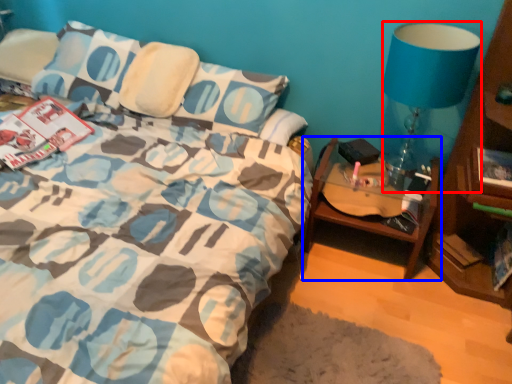
Question: Among these objects, which one is nearest to the camera, lamp (highlighted by a red box) or table (highlighted by a blue box)?

Choices:
 (A) lamp
 (B) table

Answer: (A)